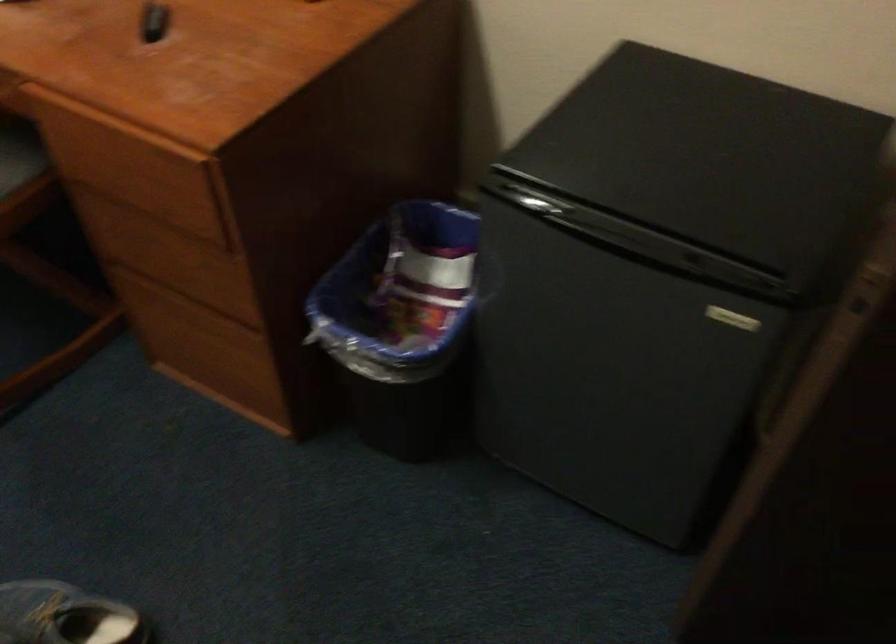
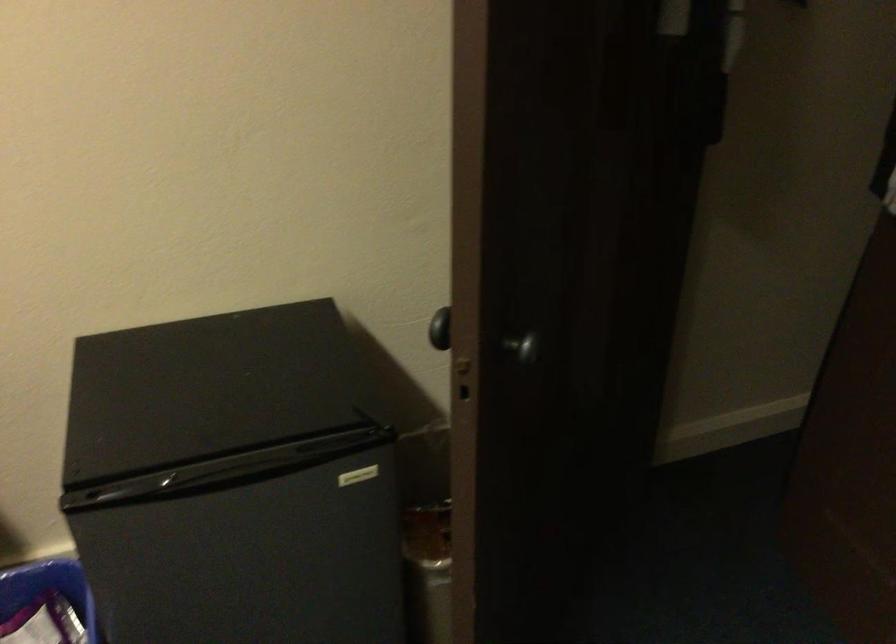
The point at [738,321] is marked in the first image. Where is the corresponding point in the second image?

(358, 476)